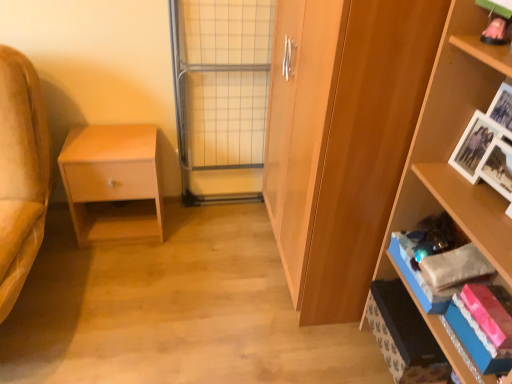
Question: Is metal grid screen door at center facing towards wooden cabinet at center?

Choices:
 (A) yes
 (B) no

Answer: (B)

Question: From a real-world perspective, is metal grid screen door at center on top of wooden cabinet at center?

Choices:
 (A) no
 (B) yes

Answer: (A)

Question: From a real-world perspective, is metal grid screen door at center below wooden cabinet at center?

Choices:
 (A) yes
 (B) no

Answer: (A)

Question: Does metal grid screen door at center have a lesser width compared to wooden cabinet at center?

Choices:
 (A) yes
 (B) no

Answer: (A)

Question: Is metal grid screen door at center not near wooden cabinet at center?

Choices:
 (A) no
 (B) yes

Answer: (A)

Question: In terms of height, does matte wood nightstand at left look taller or shorter compared to wooden shelf at right?

Choices:
 (A) tall
 (B) short

Answer: (B)

Question: Is matte wood nightstand at left wider or thinner than wooden shelf at right?

Choices:
 (A) wide
 (B) thin

Answer: (A)

Question: Choose the correct answer: Is matte wood nightstand at left inside wooden shelf at right or outside it?

Choices:
 (A) outside
 (B) inside

Answer: (A)

Question: Considering the positions of matte wood nightstand at left and wooden shelf at right in the image, is matte wood nightstand at left bigger or smaller than wooden shelf at right?

Choices:
 (A) big
 (B) small

Answer: (B)

Question: Considering the relative positions of blue cardboard box at lower right and wooden shelf at right in the image provided, is blue cardboard box at lower right to the left or to the right of wooden shelf at right?

Choices:
 (A) left
 (B) right

Answer: (A)

Question: Considering the positions of point (445, 367) and point (462, 79), is point (445, 367) closer or farther from the camera than point (462, 79)?

Choices:
 (A) closer
 (B) farther

Answer: (B)

Question: Is blue cardboard box at lower right in front of or behind wooden shelf at right in the image?

Choices:
 (A) behind
 (B) front

Answer: (A)

Question: Based on their sizes in the image, would you say blue cardboard box at lower right is bigger or smaller than wooden shelf at right?

Choices:
 (A) small
 (B) big

Answer: (A)

Question: Is matte wood nightstand at left in front of or behind blue cardboard box at lower right in the image?

Choices:
 (A) behind
 (B) front

Answer: (A)

Question: Is matte wood nightstand at left bigger or smaller than blue cardboard box at lower right?

Choices:
 (A) small
 (B) big

Answer: (B)